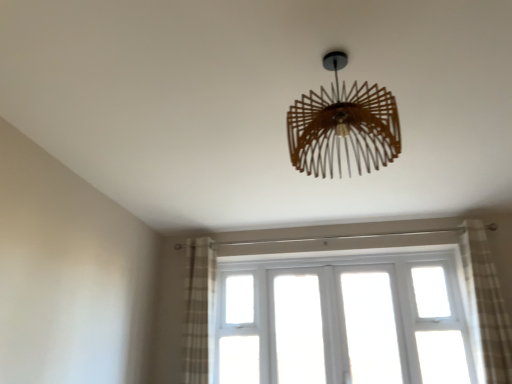
Question: Considering their positions, is wooden chandelier at center located in front of or behind plaid fabric curtain at right, the 1th curtain viewed from the right?

Choices:
 (A) front
 (B) behind

Answer: (A)

Question: From their relative heights in the image, would you say wooden chandelier at center is taller or shorter than plaid fabric curtain at right, the 1th curtain viewed from the right?

Choices:
 (A) short
 (B) tall

Answer: (A)

Question: Estimate the real-world distances between objects in this image. Which object is closer to the wooden chandelier at center?

Choices:
 (A) plaid fabric curtain at left, which is counted as the 2th curtain, starting from the right
 (B) plaid fabric curtain at right, the 2th curtain when ordered from left to right
 (C) white wooden window at center

Answer: (B)

Question: Which object is positioned farthest from the plaid fabric curtain at right, the 1th curtain viewed from the right?

Choices:
 (A) plaid fabric curtain at left, arranged as the 1th curtain when viewed from the left
 (B) wooden chandelier at center
 (C) white wooden window at center

Answer: (A)